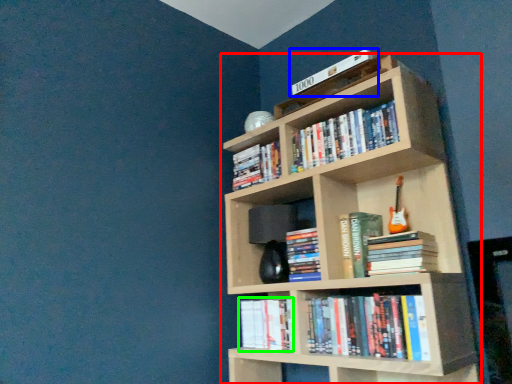
Question: Based on their relative distances, which object is farther from bookcase (highlighted by a red box)? Choose from book (highlighted by a blue box) and book (highlighted by a green box).

Choices:
 (A) book
 (B) book

Answer: (A)